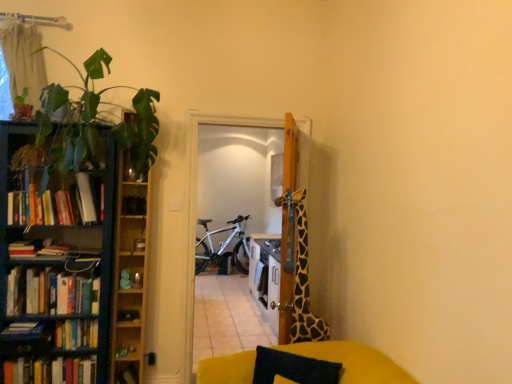
Question: Should I look upward or downward to see hardcover books at left, the 4th book positioned from the top?

Choices:
 (A) up
 (B) down

Answer: (B)

Question: Would you say hardcover books at left, placed as the 2th book when sorted from top to bottom, is part of hardcover book at left, which ranks as the first book in bottom-to-top order,'s contents?

Choices:
 (A) yes
 (B) no

Answer: (B)

Question: From a real-world perspective, is hardcover book at left, positioned as the sixth book in top-to-bottom order, physically below hardcover books at left, marked as the 5th book in a bottom-to-top arrangement?

Choices:
 (A) yes
 (B) no

Answer: (A)

Question: Is hardcover book at left, which ranks as the first book in bottom-to-top order, looking in the opposite direction of hardcover books at left, placed as the 2th book when sorted from top to bottom?

Choices:
 (A) yes
 (B) no

Answer: (B)

Question: From the image's perspective, is hardcover book at left, positioned as the sixth book in top-to-bottom order, on top of hardcover books at left, placed as the 2th book when sorted from top to bottom?

Choices:
 (A) yes
 (B) no

Answer: (B)

Question: Could you tell me if hardcover book at left, which ranks as the first book in bottom-to-top order, is turned towards hardcover books at left, marked as the 5th book in a bottom-to-top arrangement?

Choices:
 (A) no
 (B) yes

Answer: (A)

Question: Considering the relative sizes of hardcover book at left, which ranks as the first book in bottom-to-top order, and hardcover books at left, marked as the 5th book in a bottom-to-top arrangement, in the image provided, is hardcover book at left, which ranks as the first book in bottom-to-top order, shorter than hardcover books at left, marked as the 5th book in a bottom-to-top arrangement,?

Choices:
 (A) no
 (B) yes

Answer: (B)

Question: Considering the relative positions of white matte bicycle at center and wooden cabinet at left in the image provided, is white matte bicycle at center to the left of wooden cabinet at left from the viewer's perspective?

Choices:
 (A) no
 (B) yes

Answer: (A)

Question: Would you say white matte bicycle at center is outside wooden cabinet at left?

Choices:
 (A) yes
 (B) no

Answer: (A)

Question: Is white matte bicycle at center closer to camera compared to wooden cabinet at left?

Choices:
 (A) yes
 (B) no

Answer: (B)

Question: Is white matte bicycle at center further to camera compared to wooden cabinet at left?

Choices:
 (A) yes
 (B) no

Answer: (A)

Question: Does white matte bicycle at center have a lesser width compared to wooden cabinet at left?

Choices:
 (A) yes
 (B) no

Answer: (B)

Question: From a real-world perspective, is white matte bicycle at center physically below wooden cabinet at left?

Choices:
 (A) no
 (B) yes

Answer: (B)

Question: From a real-world perspective, does black fabric pillow at lower center stand above wooden cabinet at left?

Choices:
 (A) no
 (B) yes

Answer: (A)